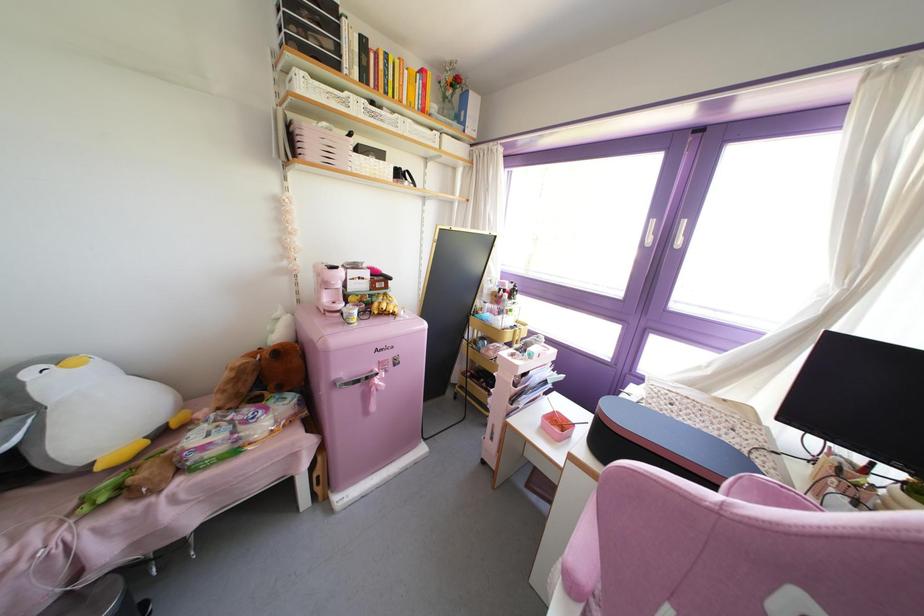
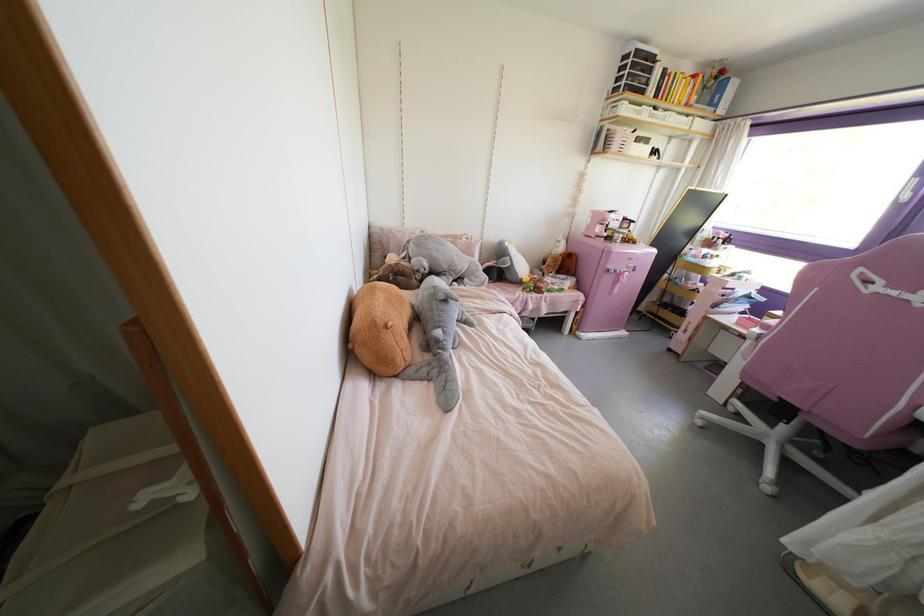
In the second image, find the point that corresponds to (x=394, y=363) in the first image.

(633, 270)